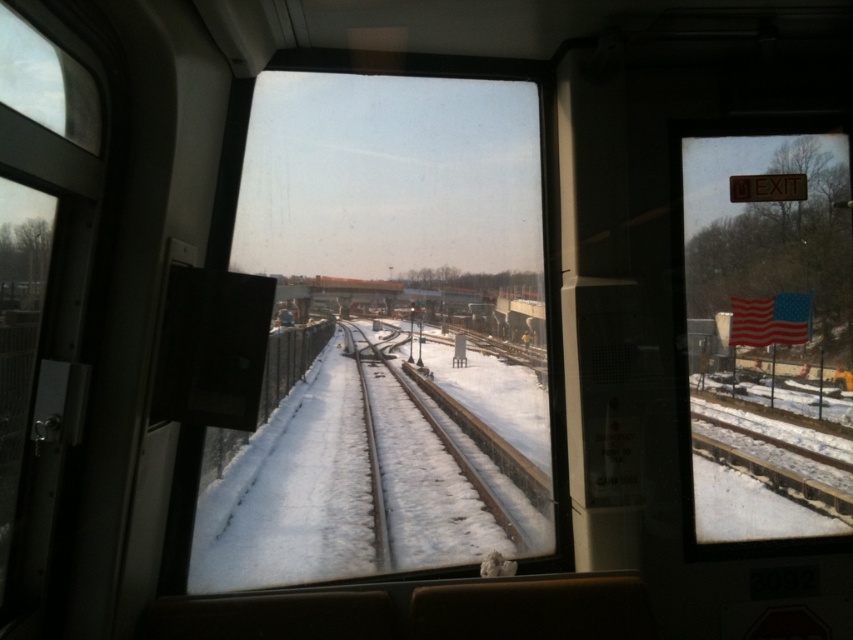
Is transparent glass train window at center shorter than clear glass flag at upper right?

No.

Which is in front, point (222, 515) or point (821, 172)?

Point (821, 172) is more forward.

Does point (264, 129) lie in front of point (753, 312)?

No, it is not.

The image size is (853, 640). I want to click on transparent glass train window at center, so click(x=387, y=333).

Can you confirm if transparent glass train window at center is positioned below snow-covered tracks at center?

No.

Which is in front, point (212, 564) or point (523, 515)?

Point (212, 564)

Is point (241, 193) farther from viewer compared to point (506, 442)?

That is False.

Where is `transparent glass train window at center`? transparent glass train window at center is located at coordinates (387, 333).

Is clear glass flag at upper right wider than snow-covered tracks at center?

Yes.

Measure the distance between point (x=793, y=262) and camera.

They are 10.98 feet apart.

The width and height of the screenshot is (853, 640). What do you see at coordinates (769, 333) in the screenshot? I see `clear glass flag at upper right` at bounding box center [769, 333].

Locate an element on the screen. This screenshot has height=640, width=853. clear glass flag at upper right is located at coordinates (769, 333).